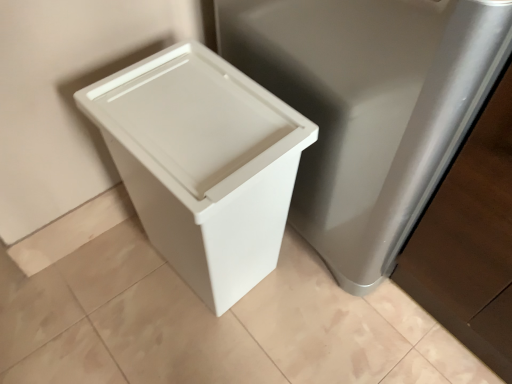
Question: Can you confirm if beige wood baseboard at lower left is taller than satin silver cabinet at right?

Choices:
 (A) no
 (B) yes

Answer: (A)

Question: Is satin silver cabinet at right at the back of beige wood baseboard at lower left?

Choices:
 (A) no
 (B) yes

Answer: (A)

Question: From the image's perspective, would you say beige wood baseboard at lower left is positioned over satin silver cabinet at right?

Choices:
 (A) no
 (B) yes

Answer: (A)

Question: Considering the relative sizes of beige wood baseboard at lower left and satin silver cabinet at right in the image provided, is beige wood baseboard at lower left smaller than satin silver cabinet at right?

Choices:
 (A) no
 (B) yes

Answer: (B)

Question: Does beige wood baseboard at lower left have a larger size compared to satin silver cabinet at right?

Choices:
 (A) no
 (B) yes

Answer: (A)

Question: From the image's perspective, is white plastic waste container at left above or below beige wood baseboard at lower left?

Choices:
 (A) above
 (B) below

Answer: (A)

Question: Considering the positions of white plastic waste container at left and beige wood baseboard at lower left in the image, is white plastic waste container at left wider or thinner than beige wood baseboard at lower left?

Choices:
 (A) thin
 (B) wide

Answer: (B)

Question: Based on their sizes in the image, would you say white plastic waste container at left is bigger or smaller than beige wood baseboard at lower left?

Choices:
 (A) small
 (B) big

Answer: (B)

Question: From their relative heights in the image, would you say white plastic waste container at left is taller or shorter than beige wood baseboard at lower left?

Choices:
 (A) short
 (B) tall

Answer: (B)

Question: Considering the positions of point (46, 244) and point (429, 221), is point (46, 244) closer or farther from the camera than point (429, 221)?

Choices:
 (A) closer
 (B) farther

Answer: (B)

Question: Considering the relative positions of beige wood baseboard at lower left and satin silver cabinet at right in the image provided, is beige wood baseboard at lower left to the left or to the right of satin silver cabinet at right?

Choices:
 (A) left
 (B) right

Answer: (A)

Question: From the image's perspective, is beige wood baseboard at lower left located above or below satin silver cabinet at right?

Choices:
 (A) below
 (B) above

Answer: (A)

Question: Is beige wood baseboard at lower left spatially inside satin silver cabinet at right, or outside of it?

Choices:
 (A) outside
 (B) inside

Answer: (A)

Question: Would you say white plastic waste container at left is inside or outside satin silver cabinet at right?

Choices:
 (A) outside
 (B) inside

Answer: (A)

Question: Considering their positions, is white plastic waste container at left located in front of or behind satin silver cabinet at right?

Choices:
 (A) front
 (B) behind

Answer: (B)